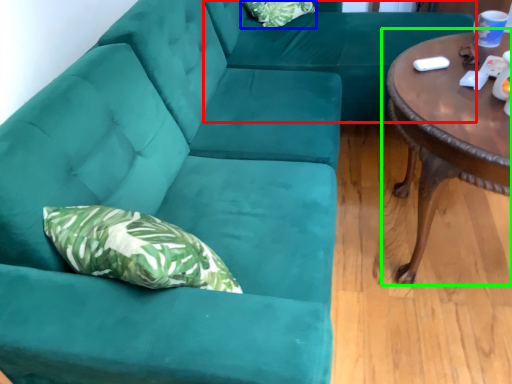
Question: Estimate the real-world distances between objects in this image. Which object is farther from couch (highlighted by a red box), pillow (highlighted by a blue box) or coffee table (highlighted by a green box)?

Choices:
 (A) pillow
 (B) coffee table

Answer: (B)